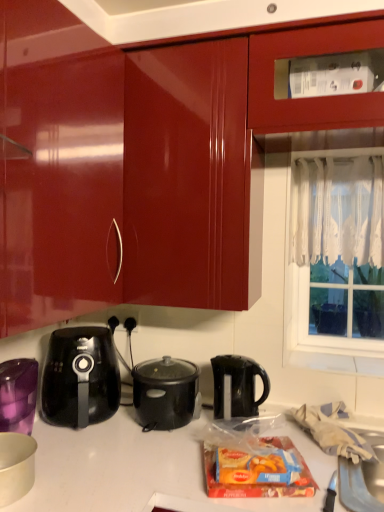
Locate an element on the screen. vacant area on top of white lace curtain at window right (from a real-world perspective) is located at coordinates (341, 157).